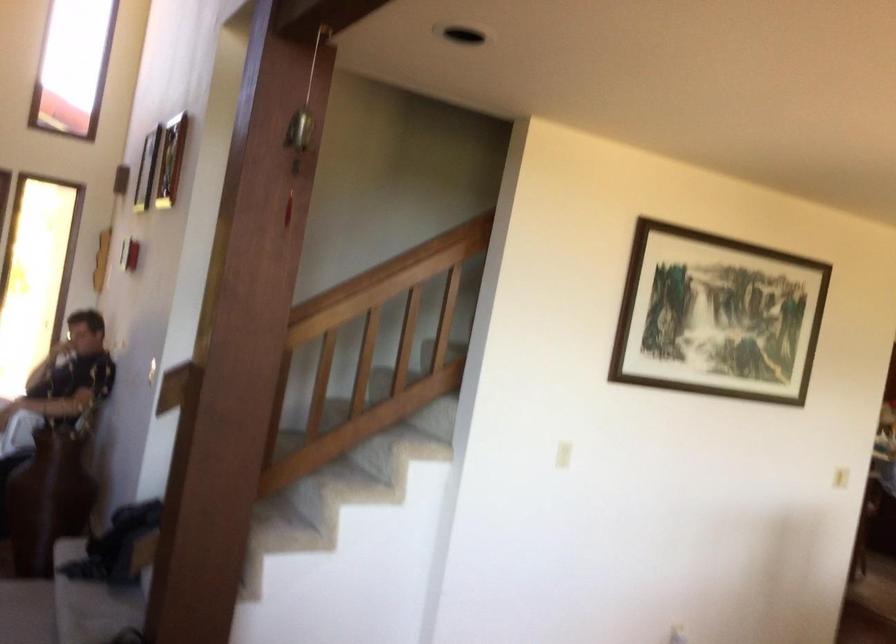
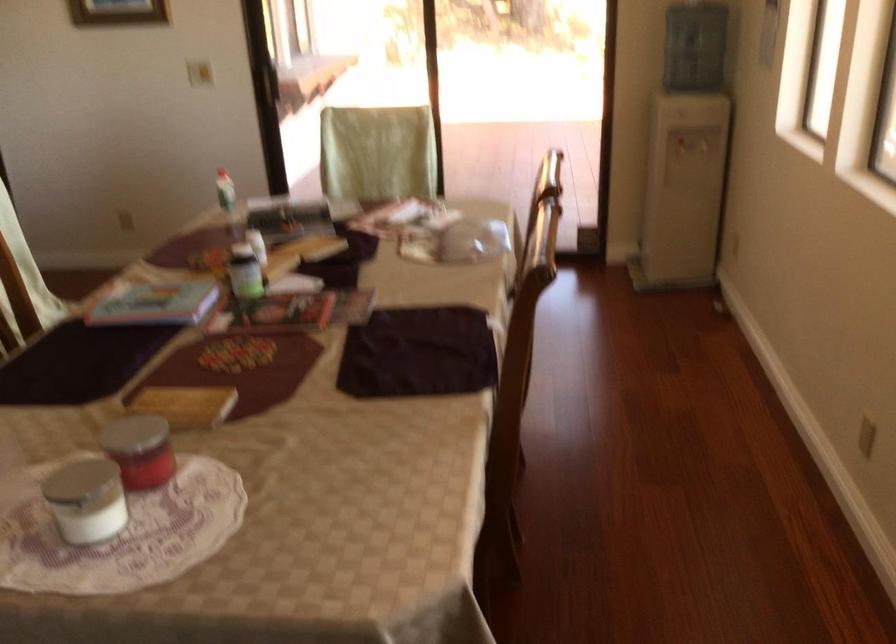
The first image is from the beginning of the video and the second image is from the end. How did the camera likely rotate when shooting the video?

The rotation direction of the camera is right-down.